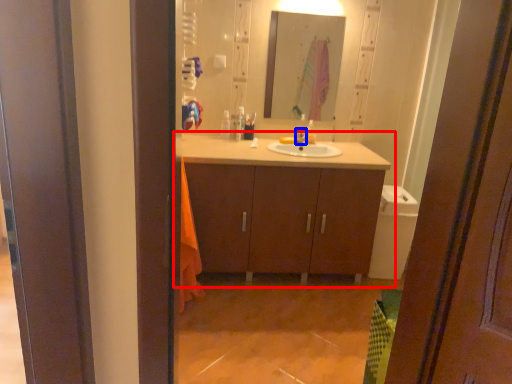
Question: Which point is further to the camera, bathroom cabinet (highlighted by a red box) or tap (highlighted by a blue box)?

Choices:
 (A) bathroom cabinet
 (B) tap

Answer: (B)